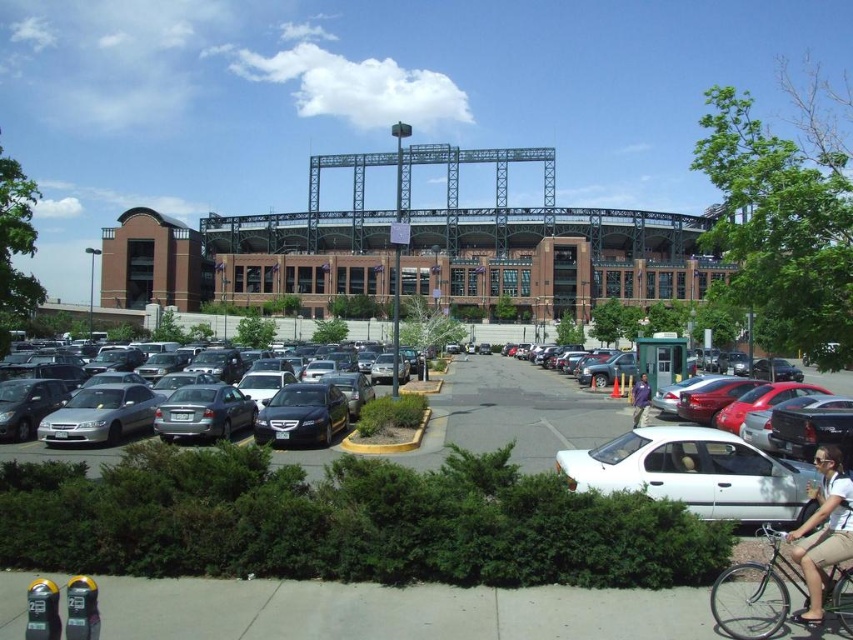
You are a photographer standing at the edge of the parking lot, and you want to capture both the tan fabric shorts at lower right and the satin black sedan at center in your photo. Which object should you focus on first to ensure both are in frame?

You should focus on the tan fabric shorts at lower right first because it is much taller than the satin black sedan at center, so adjusting the camera angle to include its height will naturally include the sedan as well.